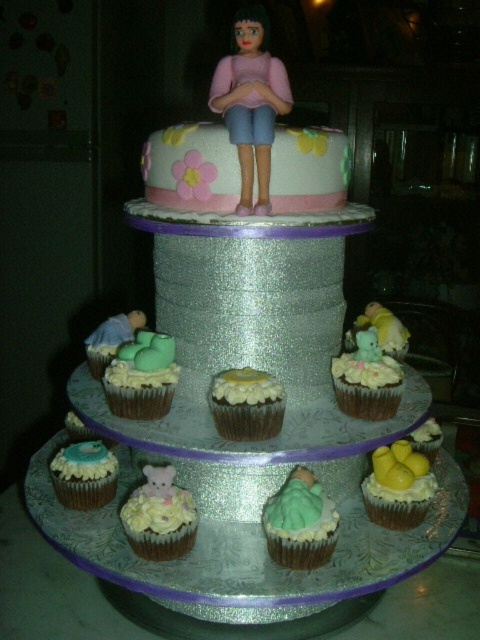
You are a guest at a birthday party and want to take a photo of the cake. You notice the pink matte plastic doll at center and the matte green frosting at center. Which object should you focus on first to ensure both are in the frame?

You should focus on the pink matte plastic doll at center first since it is closer to you than the matte green frosting at center, ensuring both are in the frame by adjusting the camera angle accordingly.

You are planning to take a photo of the pink matte plastic doll at center and the matte green frosting at center. Which object should you focus on first if you want to capture both in sharp focus?

The pink matte plastic doll at center is above the matte green frosting at center, so you should focus on the pink matte plastic doll at center first to ensure both are in sharp focus.

You are looking at the multi tiered cake and cupcakes. There are two points marked on the image, point 1 at coordinate point (x=416, y=524) and point 2 at coordinate point (x=379, y=408). Which point is closer to you?

Point (x=416, y=524) is closer to the camera than point (x=379, y=408).